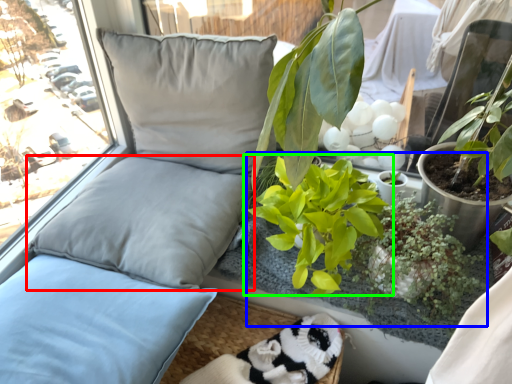
Question: Which object is the closest to the pillow (highlighted by a red box)? Choose among these: floral arrangement (highlighted by a blue box) or houseplant (highlighted by a green box).

Choices:
 (A) floral arrangement
 (B) houseplant

Answer: (B)